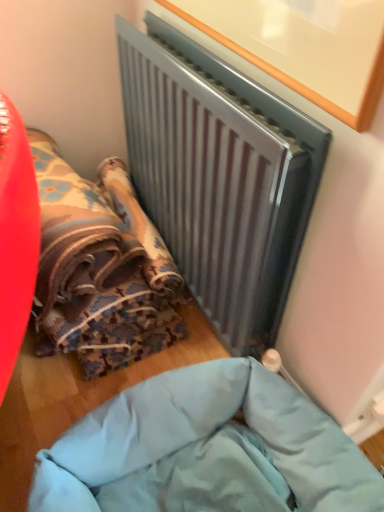
Describe the element at coordinates (219, 176) in the screenshot. I see `metallic gray radiator at upper center` at that location.

From the picture: Measure the distance between point (205, 219) and camera.

The depth of point (205, 219) is 1.04 meters.

Where is `light blue fabric at lower center`? light blue fabric at lower center is located at coordinates (206, 450).

Find the location of a particular element. The height and width of the screenshot is (512, 384). furniture that appears on the left of metallic gray radiator at upper center is located at coordinates (206, 450).

Considering the relative sizes of light blue fabric at lower center and metallic gray radiator at upper center in the image provided, is light blue fabric at lower center thinner than metallic gray radiator at upper center?

In fact, light blue fabric at lower center might be wider than metallic gray radiator at upper center.

From the image's perspective, would you say light blue fabric at lower center is positioned over metallic gray radiator at upper center?

No.

Considering the points (236, 310) and (79, 228), which point is in front, point (236, 310) or point (79, 228)?

The point (236, 310) is more forward.

Are metallic gray radiator at upper center and textured fabric bean bag at lower left located far from each other?

No, metallic gray radiator at upper center is not far away from textured fabric bean bag at lower left.

Considering the relative sizes of metallic gray radiator at upper center and textured fabric bean bag at lower left in the image provided, is metallic gray radiator at upper center bigger than textured fabric bean bag at lower left?

No.

From a real-world perspective, which is physically below, light blue fabric at lower center or textured fabric bean bag at lower left?

light blue fabric at lower center is physically lower.

From the image's perspective, would you say light blue fabric at lower center is shown under textured fabric bean bag at lower left?

Yes, from the image's perspective, light blue fabric at lower center is below textured fabric bean bag at lower left.

What's the angular difference between textured fabric bean bag at lower left and light blue fabric at lower center's facing directions?

They differ by 87.9 degrees in their facing directions.

Could you tell me if textured fabric bean bag at lower left is facing light blue fabric at lower center?

Yes, textured fabric bean bag at lower left faces towards light blue fabric at lower center.

Based on their positions, is textured fabric bean bag at lower left located to the left or right of light blue fabric at lower center?

In the image, textured fabric bean bag at lower left appears on the left side of light blue fabric at lower center.

Looking at this image, is textured fabric bean bag at lower left next to light blue fabric at lower center?

No, textured fabric bean bag at lower left is not touching light blue fabric at lower center.

Choose the correct answer: Is textured fabric bean bag at lower left inside metallic gray radiator at upper center or outside it?

textured fabric bean bag at lower left exists outside the volume of metallic gray radiator at upper center.

Looking at this image, could you tell me if textured fabric bean bag at lower left is facing metallic gray radiator at upper center?

No, textured fabric bean bag at lower left is not aimed at metallic gray radiator at upper center.

Based on the photo, considering the positions of objects textured fabric bean bag at lower left and metallic gray radiator at upper center in the image provided, who is in front, textured fabric bean bag at lower left or metallic gray radiator at upper center?

metallic gray radiator at upper center is in front.

Who is shorter, metallic gray radiator at upper center or light blue fabric at lower center?

light blue fabric at lower center.

Considering the relative positions of metallic gray radiator at upper center and light blue fabric at lower center in the image provided, is metallic gray radiator at upper center behind light blue fabric at lower center?

Yes, metallic gray radiator at upper center is further from the camera.

Consider the image. Is metallic gray radiator at upper center positioned beyond the bounds of light blue fabric at lower center?

That's correct, metallic gray radiator at upper center is outside of light blue fabric at lower center.

Is metallic gray radiator at upper center oriented away from light blue fabric at lower center?

metallic gray radiator at upper center does not have its back to light blue fabric at lower center.

Find the location of a particular element. The width and height of the screenshot is (384, 512). radiator behind the light blue fabric at lower center is located at coordinates (219, 176).

Identify the location of bean bag chair on the left of metallic gray radiator at upper center. Image resolution: width=384 pixels, height=512 pixels. (100, 267).

When comparing their distances from textured fabric bean bag at lower left, does metallic gray radiator at upper center or light blue fabric at lower center seem further?

The object further to textured fabric bean bag at lower left is light blue fabric at lower center.

From the image, which object appears to be farther from metallic gray radiator at upper center, light blue fabric at lower center or textured fabric bean bag at lower left?

Based on the image, light blue fabric at lower center appears to be further to metallic gray radiator at upper center.

When comparing their distances from light blue fabric at lower center, does textured fabric bean bag at lower left or metallic gray radiator at upper center seem further?

The object further to light blue fabric at lower center is metallic gray radiator at upper center.

When comparing their distances from light blue fabric at lower center, does metallic gray radiator at upper center or textured fabric bean bag at lower left seem further?

metallic gray radiator at upper center lies further to light blue fabric at lower center than the other object.

Considering their positions, is textured fabric bean bag at lower left positioned closer to metallic gray radiator at upper center than light blue fabric at lower center?

Among the two, textured fabric bean bag at lower left is located nearer to metallic gray radiator at upper center.

Which object lies further to the anchor point textured fabric bean bag at lower left, light blue fabric at lower center or metallic gray radiator at upper center?

Among the two, light blue fabric at lower center is located further to textured fabric bean bag at lower left.

Locate an element on the screen. Image resolution: width=384 pixels, height=512 pixels. bean bag chair between metallic gray radiator at upper center and light blue fabric at lower center from top to bottom is located at coordinates (100, 267).